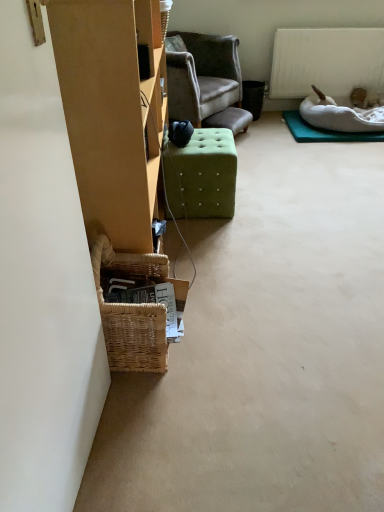
Question: From the image's perspective, relative to woven wicker basket at lower left, is green fabric ottoman at center above or below?

Choices:
 (A) above
 (B) below

Answer: (B)

Question: Is green fabric ottoman at center to the left or to the right of woven wicker basket at lower left in the image?

Choices:
 (A) right
 (B) left

Answer: (A)

Question: Considering the real-world distances, which object is farthest from the woven wicker basket at lower left?

Choices:
 (A) woven brown picnic basket at lower left
 (B) white soft dog bed at upper right
 (C) green fabric ottoman at center
 (D) white matte radiator at upper right
 (E) white fabric mat at upper right

Answer: (D)

Question: Considering the real-world distances, which object is farthest from the woven wicker basket at lower left?

Choices:
 (A) green fabric ottoman at center
 (B) white soft dog bed at upper right
 (C) white matte radiator at upper right
 (D) woven brown picnic basket at lower left
 (E) woven basket at lower left

Answer: (C)